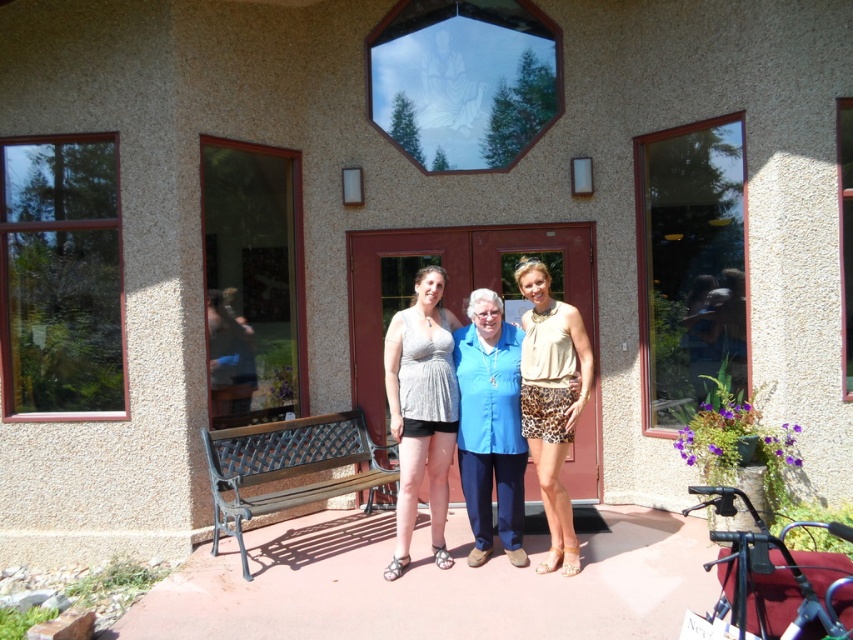
The image size is (853, 640). I want to click on shiny silver tank top at center, so click(x=421, y=410).

Who is taller, shiny silver tank top at center or leopard print shorts at center?

With more height is shiny silver tank top at center.

Describe the element at coordinates (421, 410) in the screenshot. I see `shiny silver tank top at center` at that location.

Locate an element on the screen. This screenshot has height=640, width=853. shiny silver tank top at center is located at coordinates (421, 410).

Between shiny silver tank top at center and green wrought iron bench at lower left, which one appears on the left side from the viewer's perspective?

green wrought iron bench at lower left is more to the left.

Does shiny silver tank top at center appear on the right side of green wrought iron bench at lower left?

Yes, shiny silver tank top at center is to the right of green wrought iron bench at lower left.

Does point (442, 472) come behind point (253, 513)?

Yes.

Locate an element on the screen. The height and width of the screenshot is (640, 853). shiny silver tank top at center is located at coordinates (421, 410).

Who is positioned more to the left, green wrought iron bench at lower left or leopard print shorts at center?

Positioned to the left is green wrought iron bench at lower left.

Does green wrought iron bench at lower left appear on the right side of leopard print shorts at center?

Incorrect, green wrought iron bench at lower left is not on the right side of leopard print shorts at center.

Measure the distance between point (x=292, y=460) and camera.

A distance of 17.49 feet exists between point (x=292, y=460) and camera.

At what (x,y) coordinates should I click in order to perform the action: click on green wrought iron bench at lower left. Please return your answer as a coordinate pair (x, y). Looking at the image, I should click on (287, 467).